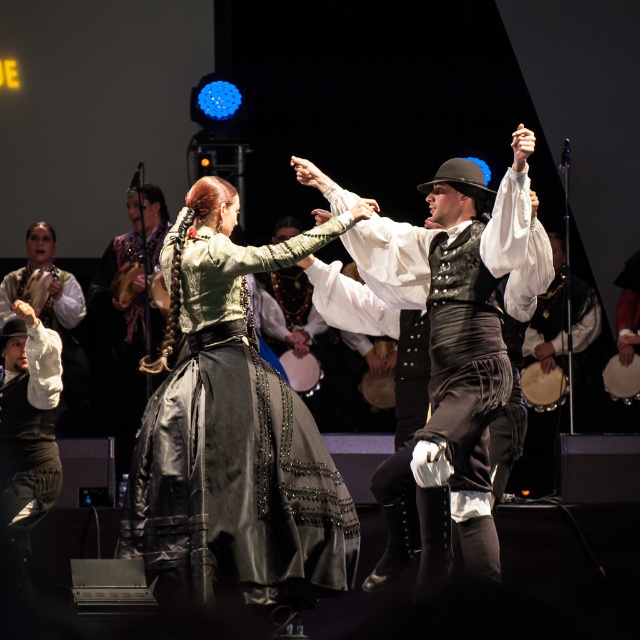
Can you confirm if satin black dress at center is wider than smooth wooden tambourine at center?

Yes.

Does satin black dress at center appear on the left side of smooth wooden tambourine at center?

Yes, satin black dress at center is to the left of smooth wooden tambourine at center.

Is point (243, 387) closer to viewer compared to point (618, 364)?

Yes, it is in front of point (618, 364).

You are a GUI agent. You are given a task and a screenshot of the screen. Output one action in this format:
    pyautogui.click(x=<x>, y=<y>)
    Task: Click on the satin black dress at center
    The image size is (640, 640).
    Given the screenshot: What is the action you would take?
    pyautogui.click(x=232, y=433)

Does smooth wooden tambourine at center come in front of wooden tambourine at center?

Yes, it is.

How far apart are smooth wooden tambourine at center and wooden tambourine at center?

smooth wooden tambourine at center and wooden tambourine at center are 3.66 meters apart from each other.

The width and height of the screenshot is (640, 640). What are the coordinates of `smooth wooden tambourine at center` in the screenshot? It's located at (621, 378).

This screenshot has height=640, width=640. I want to click on smooth wooden tambourine at center, so click(621, 378).

Is shiny black vest at center to the right of wooden tambourine at center from the viewer's perspective?

Indeed, shiny black vest at center is positioned on the right side of wooden tambourine at center.

The width and height of the screenshot is (640, 640). Describe the element at coordinates (461, 321) in the screenshot. I see `shiny black vest at center` at that location.

Image resolution: width=640 pixels, height=640 pixels. Describe the element at coordinates (461, 321) in the screenshot. I see `shiny black vest at center` at that location.

Locate an element on the screen. The height and width of the screenshot is (640, 640). shiny black vest at center is located at coordinates (461, 321).